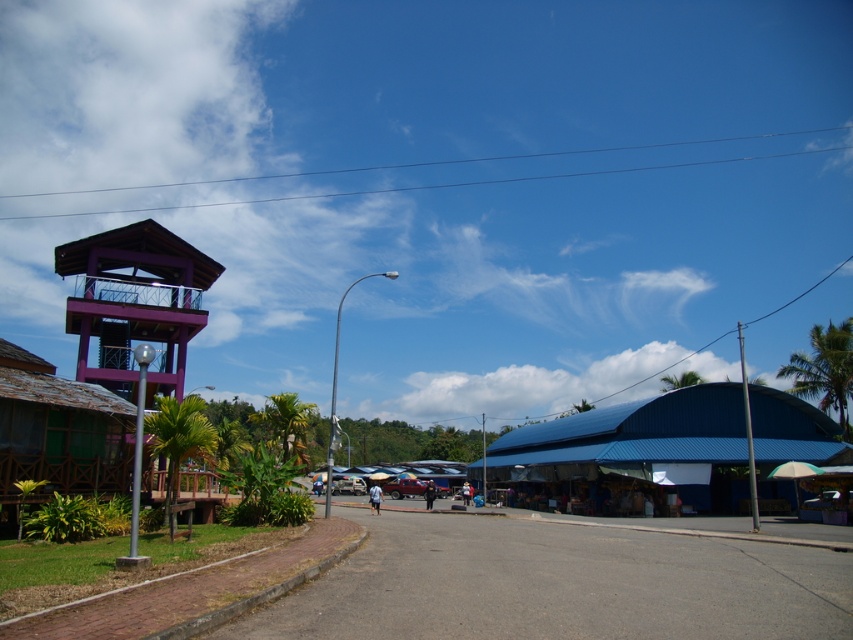
Which is more to the right, green wooden hut at left or green leafy palm tree at center-left?

green wooden hut at left

Can you confirm if green wooden hut at left is wider than green leafy palm tree at center-left?

No.

Looking at this image, who is more forward, (x=100, y=420) or (x=288, y=440)?

Positioned in front is point (x=100, y=420).

Find the location of `green wooden hut at left`. green wooden hut at left is located at coordinates (57, 429).

Does blue corrugated metal hut at center appear over purple wood tower at left?

Actually, blue corrugated metal hut at center is below purple wood tower at left.

This screenshot has width=853, height=640. Describe the element at coordinates (633, 452) in the screenshot. I see `blue corrugated metal hut at center` at that location.

Between point (664, 413) and point (126, 266), which one is positioned in front?

Point (126, 266) is more forward.

The image size is (853, 640). I want to click on blue corrugated metal hut at center, so click(x=633, y=452).

Between purple wood tower at left and green leafy palm tree at right, which one is positioned lower?

green leafy palm tree at right

Between point (137, 260) and point (820, 390), which one is positioned in front?

Point (137, 260) is in front.

Where is `purple wood tower at left`? purple wood tower at left is located at coordinates (135, 301).